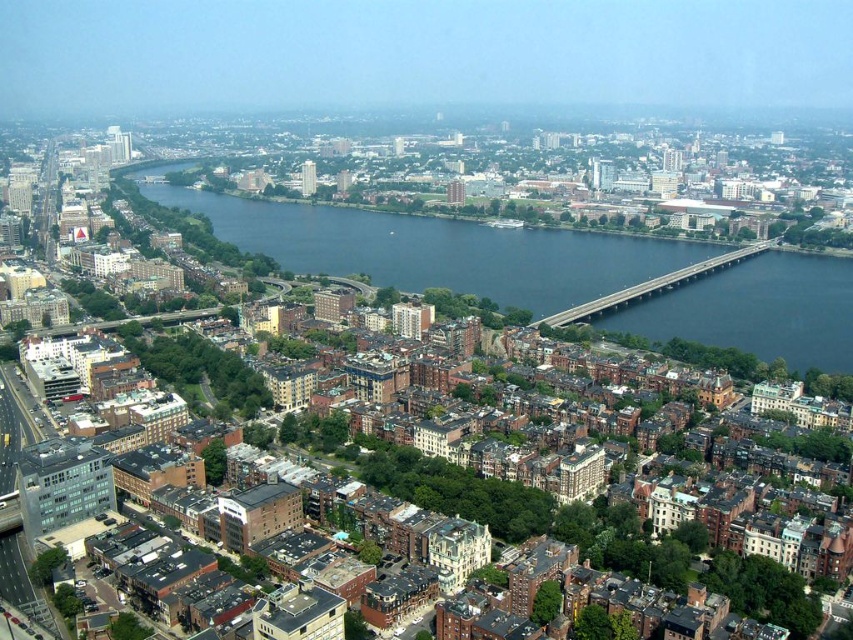
Question: Does dark blue water at center appear over concrete bridge at center?

Choices:
 (A) yes
 (B) no

Answer: (A)

Question: Considering the relative positions of dark blue water at center and concrete bridge at center in the image provided, where is dark blue water at center located with respect to concrete bridge at center?

Choices:
 (A) above
 (B) below

Answer: (A)

Question: Which point is farther to the camera?

Choices:
 (A) dark blue water at center
 (B) concrete bridge at center

Answer: (B)

Question: Can you confirm if dark blue water at center is positioned to the left of concrete bridge at center?

Choices:
 (A) no
 (B) yes

Answer: (B)

Question: Which point appears closest to the camera in this image?

Choices:
 (A) (288, 209)
 (B) (693, 264)

Answer: (B)